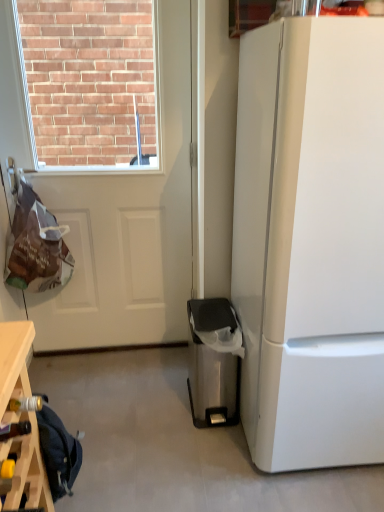
The image size is (384, 512). What are the coordinates of `free space between white glossy refrigerator at right and stainless steel trash can at lower right` in the screenshot? It's located at (233, 451).